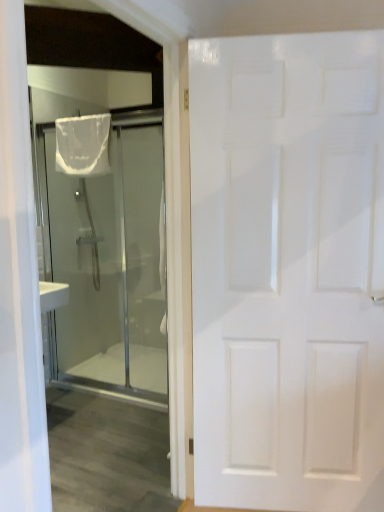
Question: Is white sheer fabric at upper left directly adjacent to white matte door at right, which is counted as the second door, starting from the back?

Choices:
 (A) no
 (B) yes

Answer: (A)

Question: From the image's perspective, would you say white sheer fabric at upper left is shown under white matte door at right, which is counted as the second door, starting from the back?

Choices:
 (A) yes
 (B) no

Answer: (B)

Question: From a real-world perspective, is white sheer fabric at upper left on top of white matte door at right, which is counted as the second door, starting from the back?

Choices:
 (A) yes
 (B) no

Answer: (A)

Question: Does white sheer fabric at upper left have a smaller size compared to white matte door at right, the second door in the left-to-right sequence?

Choices:
 (A) yes
 (B) no

Answer: (A)

Question: Would you say white matte door at right, which is the first door in right-to-left order, is part of white sheer fabric at upper left's contents?

Choices:
 (A) yes
 (B) no

Answer: (B)

Question: Do you think white matte door at right, which is counted as the second door, starting from the back, is within transparent glass shower at left, which ranks as the first door in left-to-right order, or outside of it?

Choices:
 (A) outside
 (B) inside

Answer: (A)

Question: Is white matte door at right, which is the first door from front to back, bigger or smaller than transparent glass shower at left, the second door viewed from the front?

Choices:
 (A) big
 (B) small

Answer: (A)

Question: Is point (322, 384) closer or farther from the camera than point (52, 159)?

Choices:
 (A) farther
 (B) closer

Answer: (B)

Question: In terms of width, does white matte door at right, which is the first door from front to back, look wider or thinner when compared to transparent glass shower at left, the 1th door in the back-to-front sequence?

Choices:
 (A) thin
 (B) wide

Answer: (B)

Question: Considering the relative positions of transparent glass shower at left, which ranks as the first door in left-to-right order, and white matte door at right, the second door in the left-to-right sequence, in the image provided, is transparent glass shower at left, which ranks as the first door in left-to-right order, to the left or to the right of white matte door at right, the second door in the left-to-right sequence,?

Choices:
 (A) right
 (B) left

Answer: (B)

Question: Considering the positions of transparent glass shower at left, which ranks as the first door in left-to-right order, and white matte door at right, which is counted as the second door, starting from the back, in the image, is transparent glass shower at left, which ranks as the first door in left-to-right order, taller or shorter than white matte door at right, which is counted as the second door, starting from the back,?

Choices:
 (A) tall
 (B) short

Answer: (B)

Question: From a real-world perspective, is transparent glass shower at left, the 2th door in the right-to-left sequence, above or below white matte door at right, the second door in the left-to-right sequence?

Choices:
 (A) below
 (B) above

Answer: (A)

Question: Considering the positions of transparent glass shower at left, the 2th door in the right-to-left sequence, and white matte door at right, which is counted as the second door, starting from the back, in the image, is transparent glass shower at left, the 2th door in the right-to-left sequence, bigger or smaller than white matte door at right, which is counted as the second door, starting from the back,?

Choices:
 (A) big
 (B) small

Answer: (B)

Question: From their relative heights in the image, would you say white sheer fabric at upper left is taller or shorter than transparent glass shower at left, which ranks as the first door in left-to-right order?

Choices:
 (A) tall
 (B) short

Answer: (B)

Question: Considering the positions of point (96, 150) and point (152, 198), is point (96, 150) closer or farther from the camera than point (152, 198)?

Choices:
 (A) farther
 (B) closer

Answer: (B)